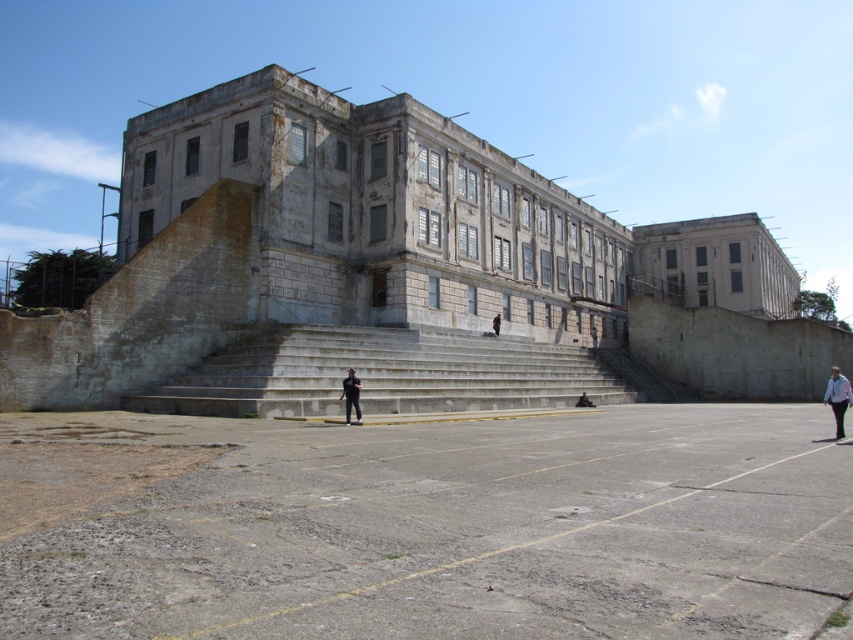
You are standing in front of the building and see two points marked on the facade. The first point is at coordinate (434, 381) and the second is at (833, 403). Which point is closer to you?

Point (833, 403) is closer to you because it is less further to the camera compared to point (434, 381).